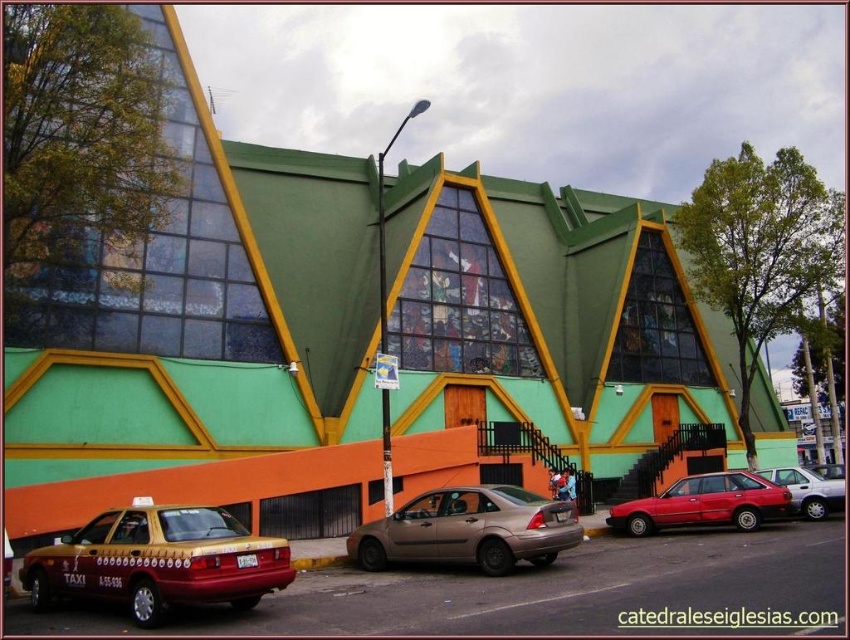
Who is higher up, metallic gold taxi at lower left or matte red sedan at center?

metallic gold taxi at lower left

Which is below, metallic gold taxi at lower left or matte red sedan at center?

matte red sedan at center

Between point (115, 595) and point (792, 468), which one is positioned in front?

Point (115, 595)

Identify the location of metallic gold taxi at lower left. (157, 561).

Between matte red sedan at center and metallic silver sedan at center, which one is positioned higher?

matte red sedan at center is above.

Does matte red sedan at center appear on the left side of metallic silver sedan at center?

Indeed, matte red sedan at center is positioned on the left side of metallic silver sedan at center.

Where is `matte red sedan at center`? This screenshot has height=640, width=850. matte red sedan at center is located at coordinates (808, 490).

Where is `matte red sedan at center`? matte red sedan at center is located at coordinates (808, 490).

Is metallic gold taxi at lower left to the left of gold metallic sedan at center from the viewer's perspective?

Indeed, metallic gold taxi at lower left is positioned on the left side of gold metallic sedan at center.

Can you confirm if metallic gold taxi at lower left is smaller than gold metallic sedan at center?

Correct, metallic gold taxi at lower left occupies less space than gold metallic sedan at center.

Where is `metallic gold taxi at lower left`? metallic gold taxi at lower left is located at coordinates (157, 561).